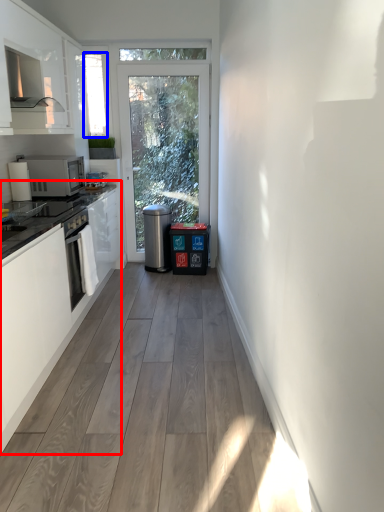
Question: Which of the following is the farthest to the observer, cabinetry (highlighted by a red box) or window screen (highlighted by a blue box)?

Choices:
 (A) cabinetry
 (B) window screen

Answer: (B)